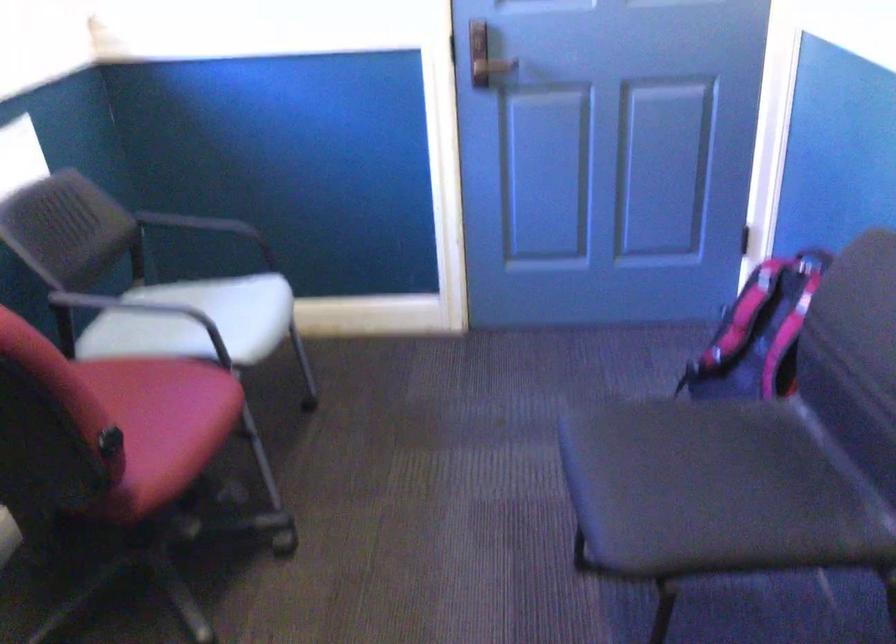
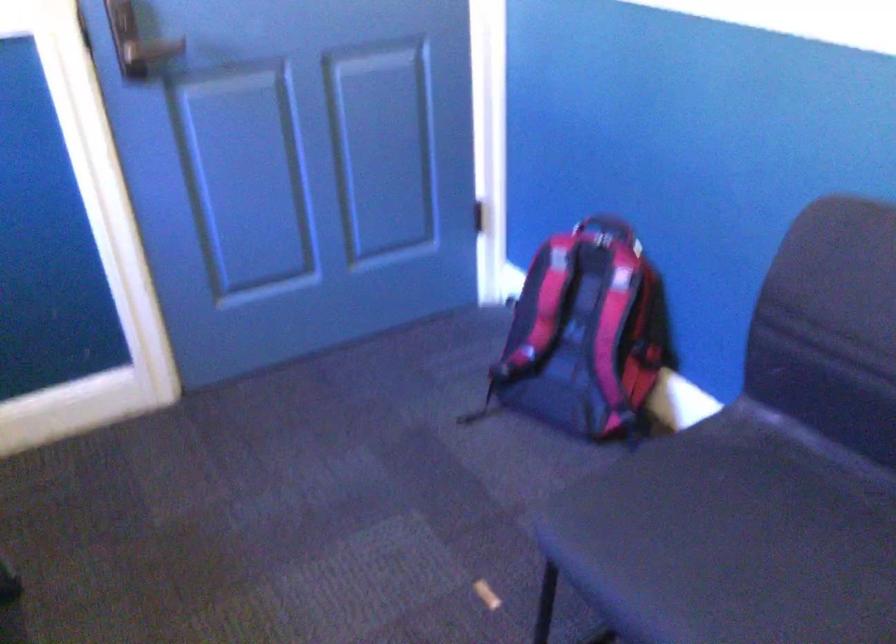
Where in the second image is the point corresponding to [767,351] from the first image?

(584, 335)